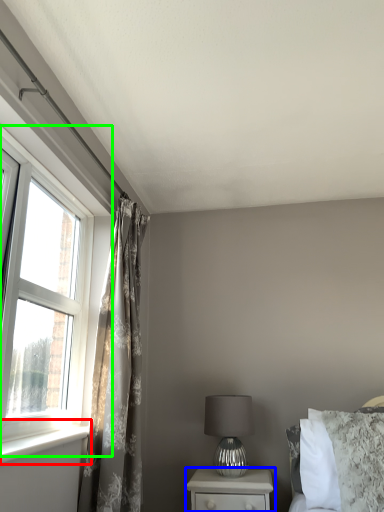
Question: Estimate the real-world distances between objects in this image. Which object is farther from window sill (highlighted by a red box), nightstand (highlighted by a blue box) or window (highlighted by a green box)?

Choices:
 (A) nightstand
 (B) window

Answer: (A)